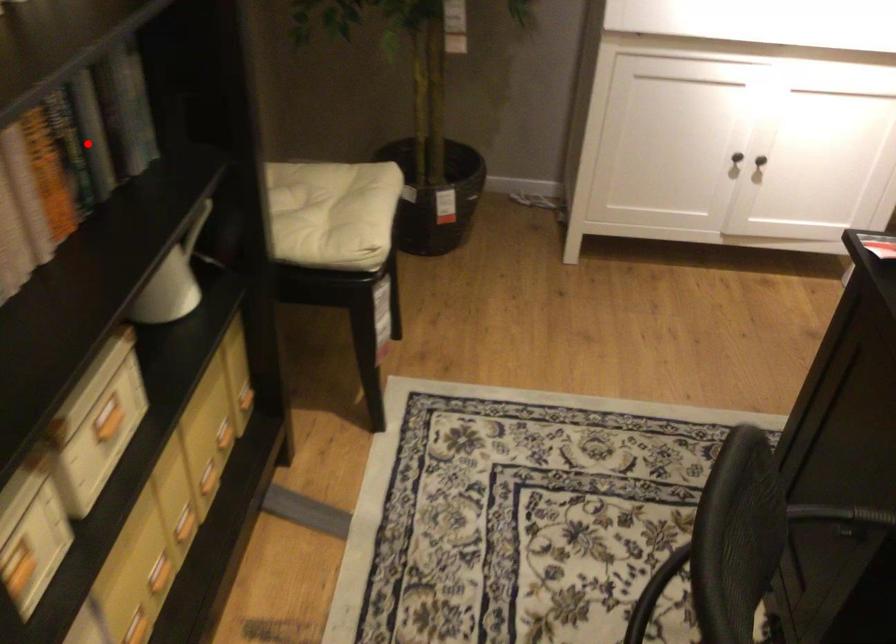
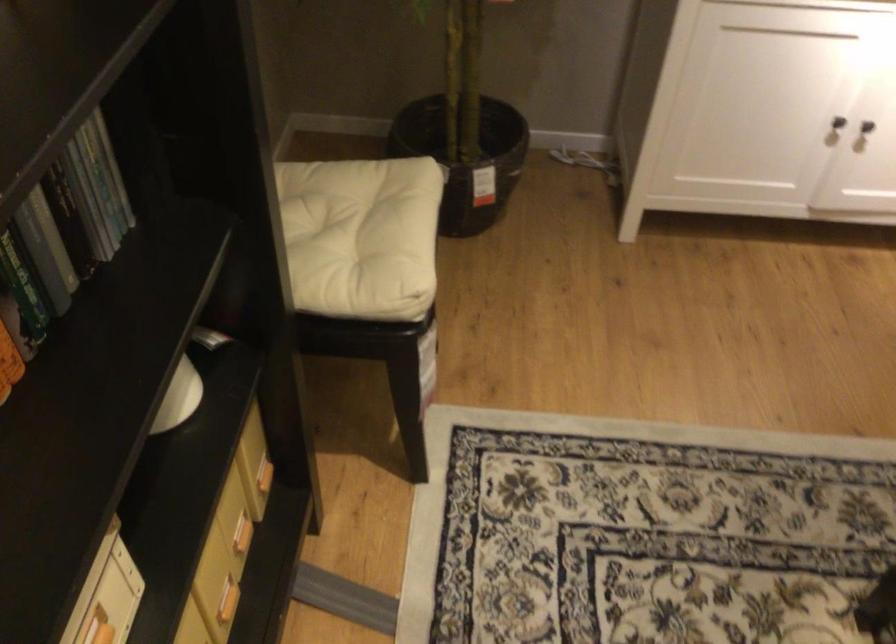
Question: I am providing you with two images of the same scene from different viewpoints. In image1, a red point is highlighted. Considering the same 3D point in image2, which of the following is correct?

Choices:
 (A) It is closer
 (B) It is farther

Answer: (A)